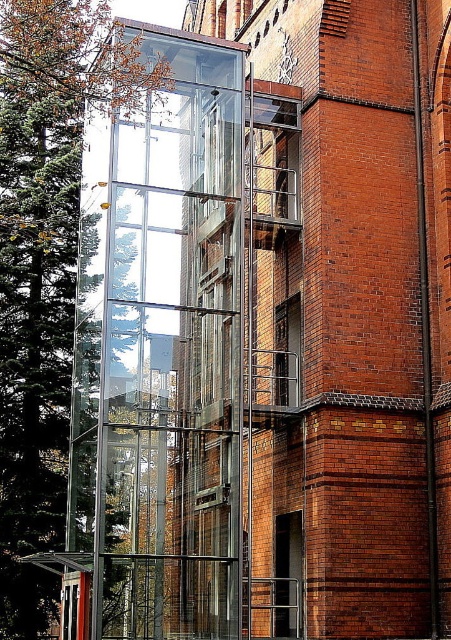
You are a maintenance worker needing to reach the transparent glass elevator at center from the green leafy tree at left. Given that your ladder is 50 feet long, will it be sufficient to bridge the gap between them?

The distance between the transparent glass elevator at center and the green leafy tree at left is 56.72 feet. Since the ladder is only 50 feet long, it is not long enough to bridge the gap between them.

You are standing at the camera position and want to take a photo of the transparent glass elevator at center. The camera has a maximum focus range of 45 meters. Will the elevator be in focus?

The transparent glass elevator at center is 44.84 meters from the camera, which is within the maximum focus range of 45 meters. Therefore, the elevator will be in focus.

You are standing in front of the transparent glass elevator at center and the green leafy tree at left. Which object appears narrower from your perspective?

The transparent glass elevator at center is thinner than the green leafy tree at left, so it appears narrower from your perspective.